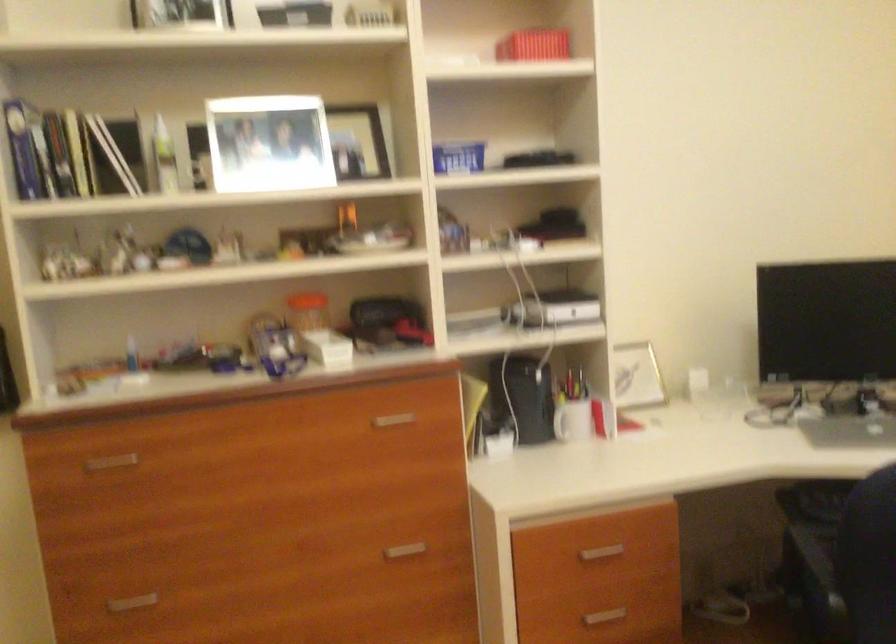
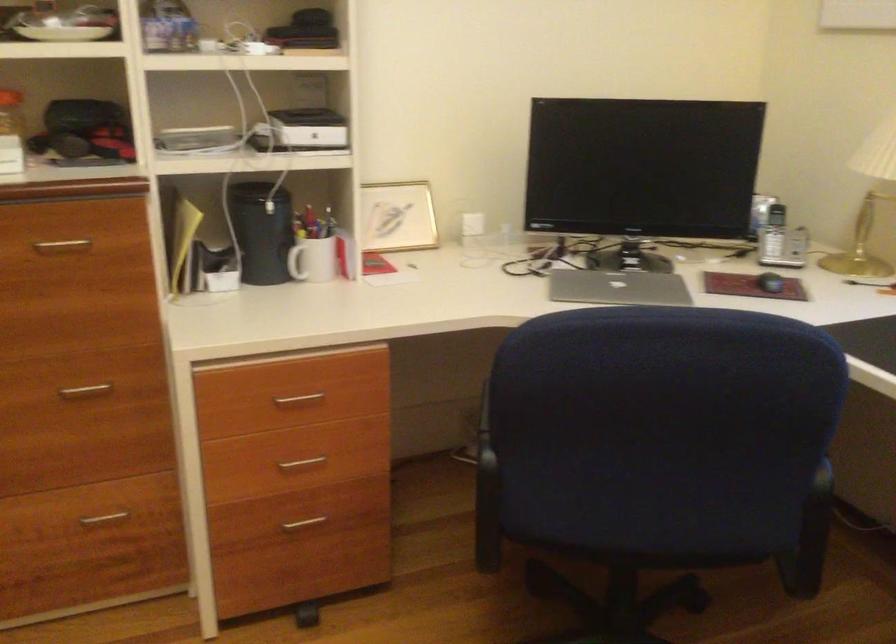
Question: How did the camera likely rotate?

Choices:
 (A) Left
 (B) Right
 (C) Up
 (D) Down

Answer: (D)